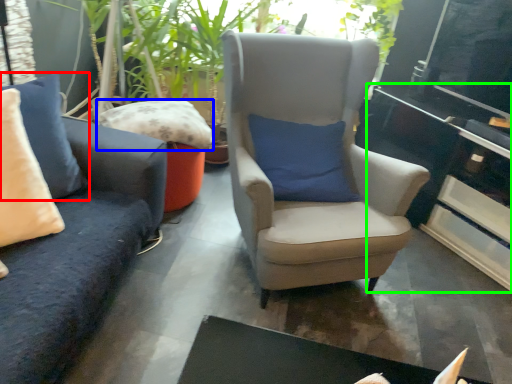
Question: Based on their relative distances, which object is nearer to pillow (highlighted by a red box)? Choose from pillow (highlighted by a blue box) and table (highlighted by a green box).

Choices:
 (A) pillow
 (B) table

Answer: (A)